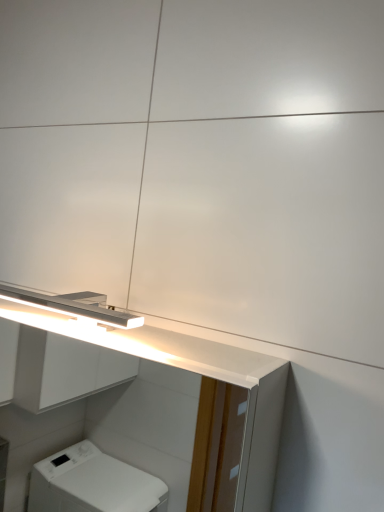
Question: Does point (94, 364) appear closer or farther from the camera than point (69, 312)?

Choices:
 (A) closer
 (B) farther

Answer: (B)

Question: Is satin white cabinet at upper center taller or shorter than satin nickel light fixture at upper left?

Choices:
 (A) tall
 (B) short

Answer: (A)

Question: Which is correct: satin white cabinet at upper center is inside satin nickel light fixture at upper left, or outside of it?

Choices:
 (A) inside
 (B) outside

Answer: (B)

Question: Based on their sizes in the image, would you say satin nickel light fixture at upper left is bigger or smaller than satin white cabinet at upper center?

Choices:
 (A) big
 (B) small

Answer: (B)

Question: In the image, is satin nickel light fixture at upper left positioned in front of or behind satin white cabinet at upper center?

Choices:
 (A) front
 (B) behind

Answer: (B)

Question: From their relative heights in the image, would you say satin nickel light fixture at upper left is taller or shorter than satin white cabinet at upper center?

Choices:
 (A) short
 (B) tall

Answer: (A)

Question: Is satin nickel light fixture at upper left wider or thinner than satin white cabinet at upper center?

Choices:
 (A) thin
 (B) wide

Answer: (A)